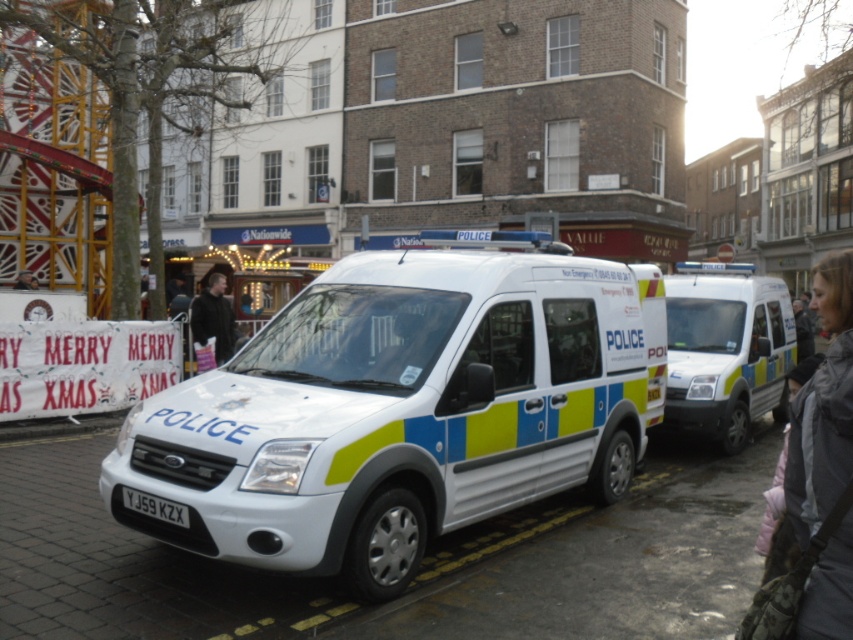
You are a delivery person trying to park your truck between the white glossy police van at center and the gray fabric jacket at right. Can your truck, which is 2 meters wide, fit in the available space?

The white glossy police van at center is narrower than the gray fabric jacket at right, but the description only provides their widths relative to each other, not the exact space between them. Without knowing the distance between the two objects, it is impossible to determine if the truck can fit.

You are a pedestrian standing at point (395, 410). You see the white glossy police van at center. Which direction should you walk to reach the van?

The white glossy police van at center is located at your current position, so you are already at the van.

You are a police officer at the scene and need to choose a jacket to wear. The gray fabric jacket at right and the black leather jacket at center are available. Which jacket should you choose if you want the larger one?

The gray fabric jacket at right is larger in size than the black leather jacket at center, so you should choose the gray fabric jacket at right.